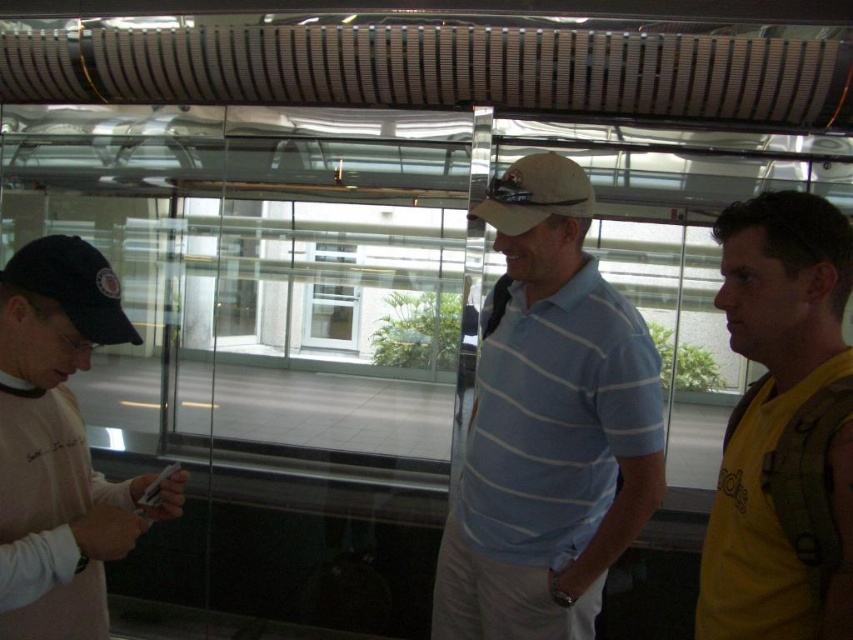
You are a security guard at this location and need to monitor the individuals. Which individual is positioned lower in the scene between the yellow fabric shirt at right and the matte khaki baseball cap at center?

The yellow fabric shirt at right is located below the matte khaki baseball cap at center, so the individual with the yellow fabric shirt at right is positioned lower in the scene.

You are a photographer trying to capture a group photo of the light blue striped polo shirt at center and the black fabric baseball cap at left. Since you want to ensure both subjects are in focus, you need to know their heights. Which of the two is taller?

The light blue striped polo shirt at center is much taller than the black fabric baseball cap at left, so the photographer should adjust the camera angle to account for the height difference.